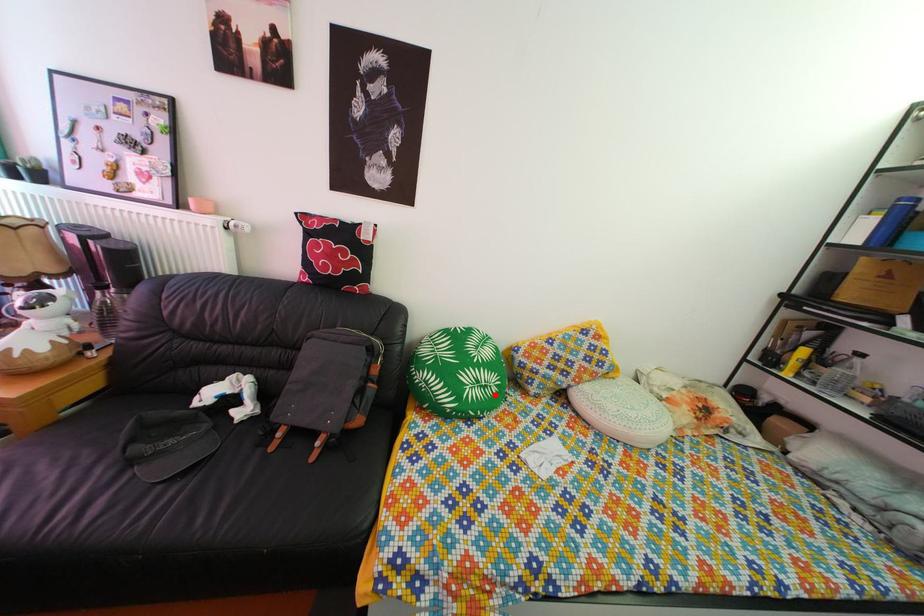
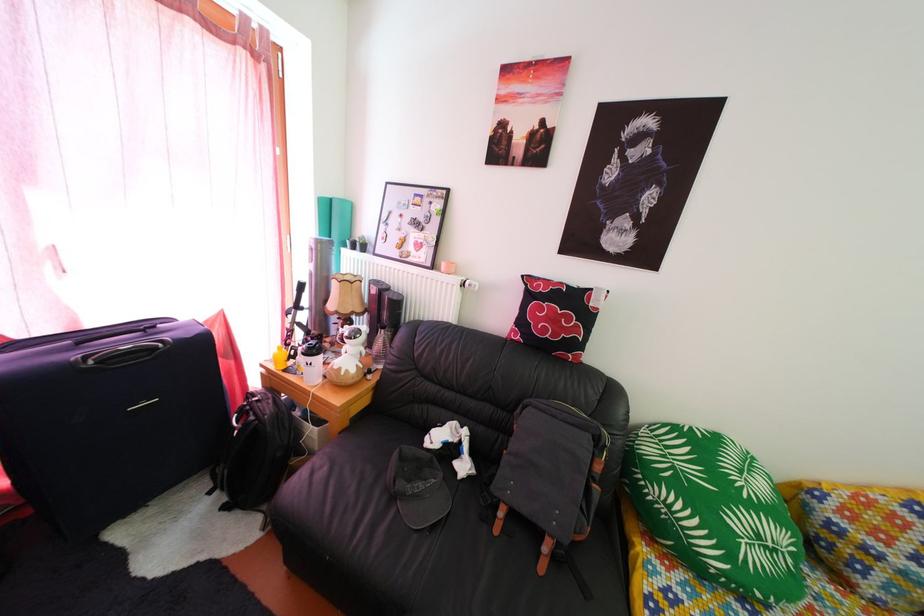
Where in the second image is the point corresponding to the highlighted location from the first image?

(784, 560)